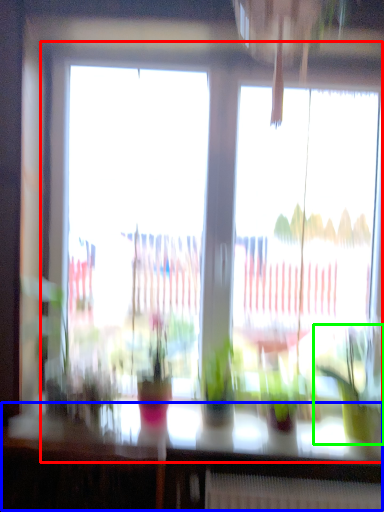
Question: Which is farther away from window (highlighted by a red box)? table (highlighted by a blue box) or houseplant (highlighted by a green box)?

Choices:
 (A) table
 (B) houseplant

Answer: (A)